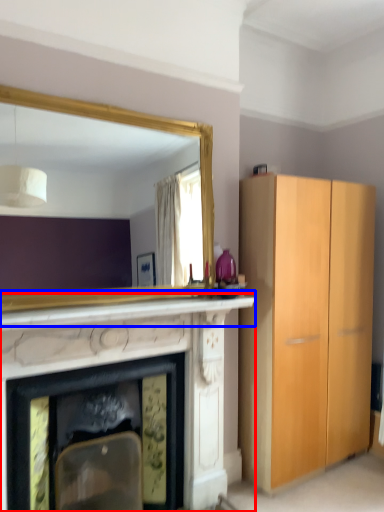
Question: Which point is closer to the camera, fireplace (highlighted by a red box) or mantle (highlighted by a blue box)?

Choices:
 (A) fireplace
 (B) mantle

Answer: (B)